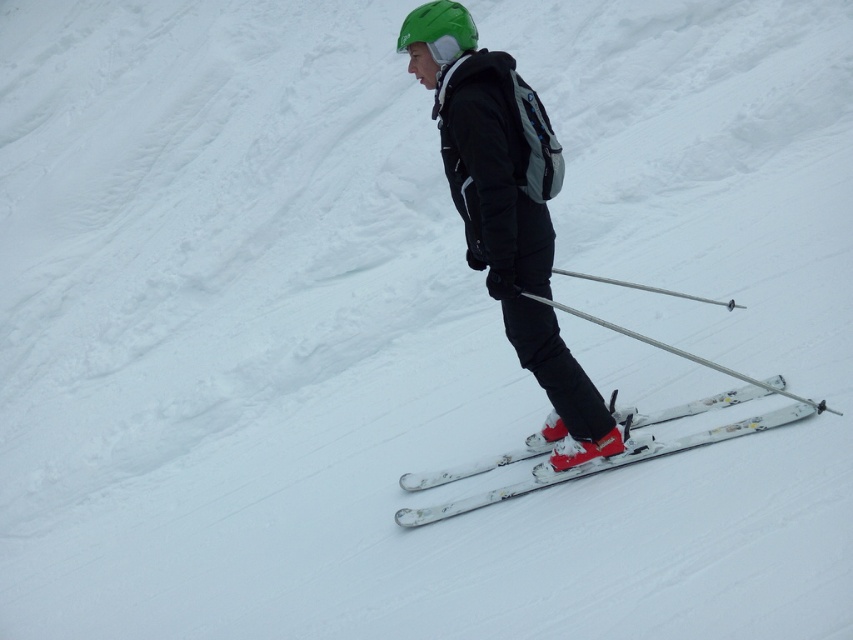
You are standing at the point marked as point (439, 508) on a snowy slope. You want to throw a snowball towards a friend who is standing 6 meters away from you. If your friend is in the direction of the viewer, will you be able to hit them with the snowball?

The point (439, 508) and viewer are 6.04 meters apart, so yes, you can hit your friend who is 6 meters away in the direction of the viewer because the distance is approximately 6 meters.

Based on the photo, you are a photographer trying to capture the skier wearing a black ski suit at center. You notice a specific point marked at coordinates (508, 209). Where exactly on the skier should you focus your camera to ensure the point is captured?

The point (508, 209) is located on the matte black ski suit at center, so you should focus your camera on the skier wearing the matte black ski suit at center to capture the point.

You are a photographer trying to capture a closeup shot of the matte black ski suit at center and the silver metallic ski pole at center. Given that your camera can focus on objects within a 50 cm range, will both items be in focus?

The distance between the matte black ski suit at center and the silver metallic ski pole at center is 56.62 centimeters. Since the camera can only focus within 50 cm, the items are slightly out of the focus range. Adjust your position to reduce the distance between them or use a different camera setting for better focus.